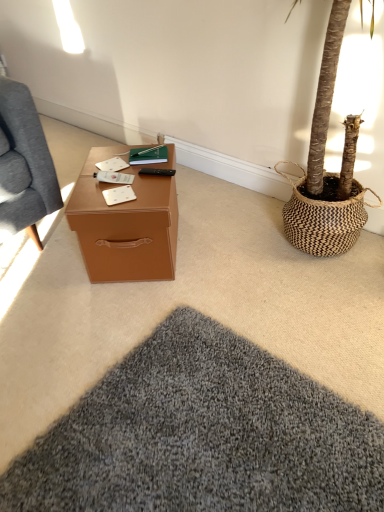
Image resolution: width=384 pixels, height=512 pixels. Find the location of `unoccupied space behind white matte notepad at center`. unoccupied space behind white matte notepad at center is located at coordinates (121, 173).